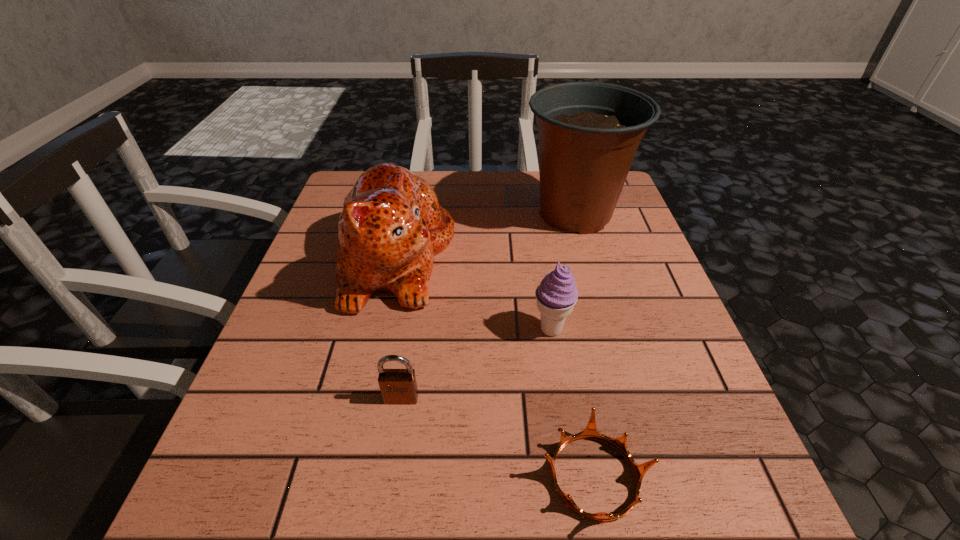
Image resolution: width=960 pixels, height=540 pixels. Find the location of `flowerpot`. flowerpot is located at coordinates (589, 132).

You are a GUI agent. You are given a task and a screenshot of the screen. Output one action in this format:
    pyautogui.click(x=<x>, y=<y>)
    Task: Click on the cat
    
    Given the screenshot: What is the action you would take?
    pyautogui.click(x=391, y=226)

Where is `the third shortest object`? This screenshot has width=960, height=540. the third shortest object is located at coordinates (557, 294).

Find the location of a particular element. The width and height of the screenshot is (960, 540). the fourth tallest object is located at coordinates (398, 386).

Find the location of `padlock`. padlock is located at coordinates (398, 386).

Identify the location of the nearest object. This screenshot has width=960, height=540. (590, 432).

Locate an element on the screen. Image resolution: width=960 pixels, height=540 pixels. the shortest object is located at coordinates (590, 432).

Find the location of a particular element. vacant area situated on the left of the flowerpot is located at coordinates pos(493,214).

The height and width of the screenshot is (540, 960). In order to click on free space located on the face of the fourth shortest object in this screenshot , I will do `click(599, 257)`.

The image size is (960, 540). Identify the location of vacant space located on the left of the third shortest object. (348, 329).